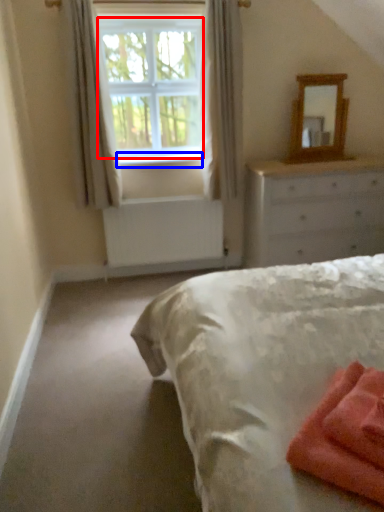
Question: Which point is further to the camera, window screen (highlighted by a red box) or window sill (highlighted by a blue box)?

Choices:
 (A) window screen
 (B) window sill

Answer: (B)